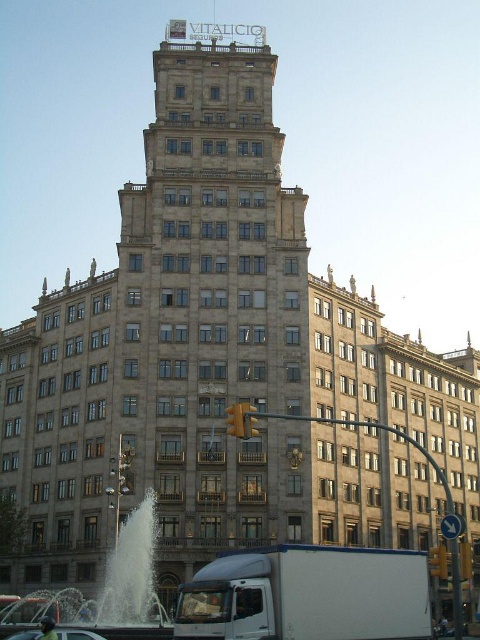
How far apart are white marble fountain at lower center and metallic silver car at lower center?

white marble fountain at lower center and metallic silver car at lower center are 5.14 meters apart from each other.

Who is taller, white marble fountain at lower center or metallic silver car at lower center?

white marble fountain at lower center is taller.

Is point (47, 604) farther from camera compared to point (48, 637)?

Yes, it is.

The width and height of the screenshot is (480, 640). What are the coordinates of `white marble fountain at lower center` in the screenshot? It's located at (120, 586).